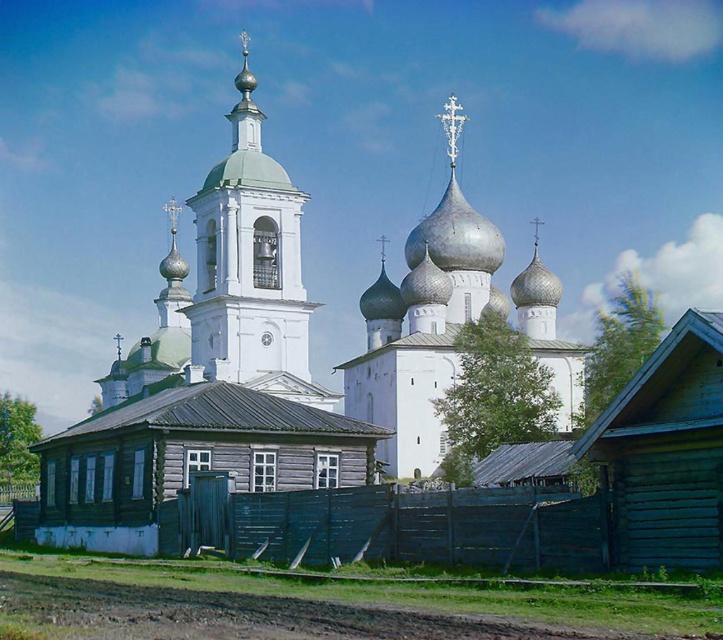
Question: Does blue wooden fence at lower center have a lesser width compared to silver metallic dome at center?

Choices:
 (A) yes
 (B) no

Answer: (B)

Question: Which object is positioned closest to the white stone bell tower at center?

Choices:
 (A) blue wooden fence at lower center
 (B) white stone church at center

Answer: (B)

Question: Estimate the real-world distances between objects in this image. Which object is closer to the silver metallic dome at center?

Choices:
 (A) blue wooden fence at lower center
 (B) white stone bell tower at center

Answer: (B)

Question: Does white stone church at center have a lesser width compared to silver metallic dome at center?

Choices:
 (A) yes
 (B) no

Answer: (B)

Question: Can you confirm if white stone bell tower at center is positioned below silver metallic dome at center?

Choices:
 (A) no
 (B) yes

Answer: (A)

Question: Among these objects, which one is nearest to the camera?

Choices:
 (A) white stone church at center
 (B) silver metallic dome at center

Answer: (A)